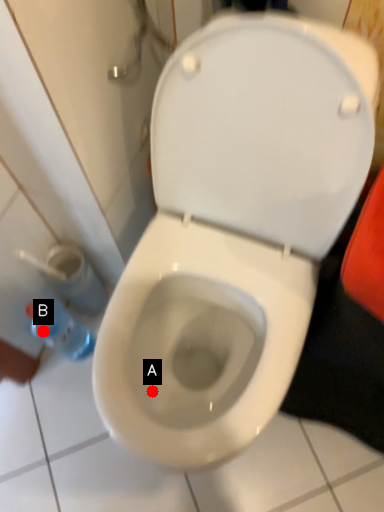
Question: Two points are circled on the image, labeled by A and B beside each circle. Among these points, which one is nearest to the camera?

Choices:
 (A) A is closer
 (B) B is closer

Answer: (A)